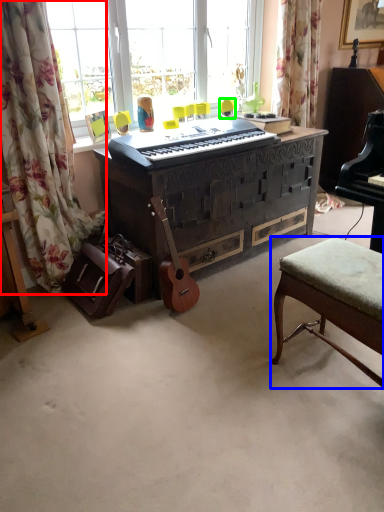
Question: Which object is positioned farthest from curtain (highlighted by a red box)? Select from stool (highlighted by a blue box) and swivel chair (highlighted by a green box).

Choices:
 (A) stool
 (B) swivel chair

Answer: (B)